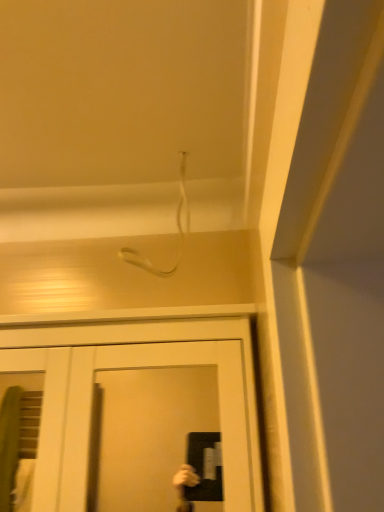
What do you see at coordinates (134, 368) in the screenshot? I see `matte white door at center` at bounding box center [134, 368].

Consider the image. What is the approximate width of matte white door at center?

matte white door at center is 7.71 inches wide.

At what (x,y) coordinates should I click in order to perform the action: click on matte white door at center. Please return your answer as a coordinate pair (x, y). This screenshot has height=512, width=384. Looking at the image, I should click on (134, 368).

Locate an element on the screen. Image resolution: width=384 pixels, height=512 pixels. matte white door at center is located at coordinates (134, 368).